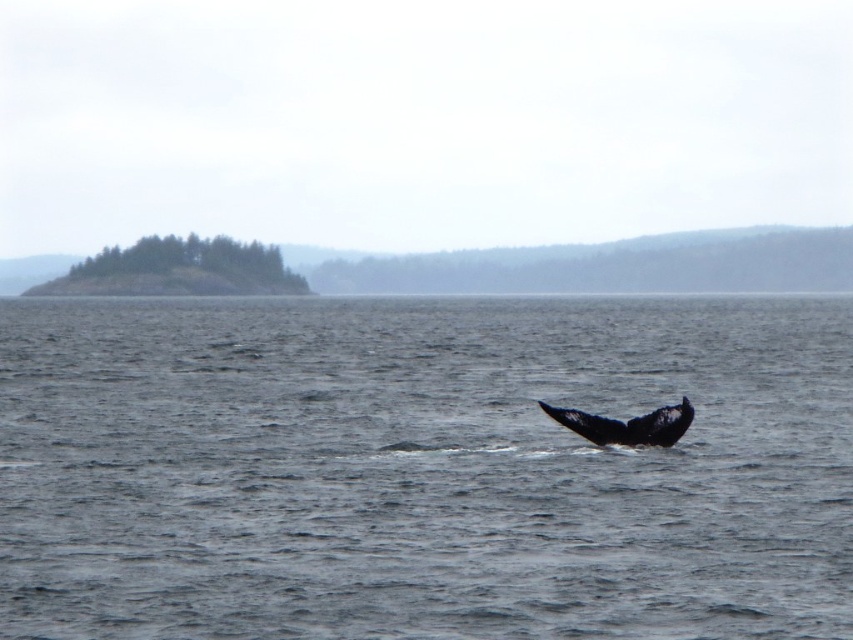
Can you confirm if dark gray water at center is bigger than black matte whale tail at lower right?

Correct, dark gray water at center is larger in size than black matte whale tail at lower right.

Image resolution: width=853 pixels, height=640 pixels. I want to click on dark gray water at center, so click(x=422, y=468).

I want to click on dark gray water at center, so click(x=422, y=468).